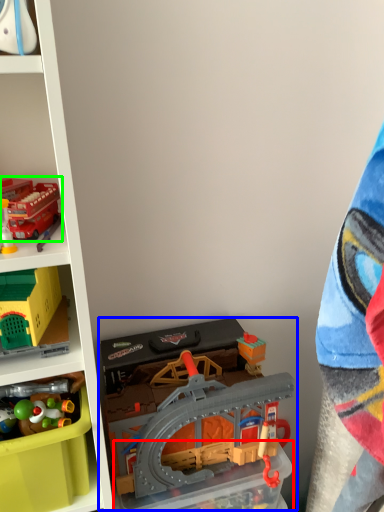
Question: Which is farther away from storage box (highlighted by a red box)? toy (highlighted by a blue box) or toy (highlighted by a green box)?

Choices:
 (A) toy
 (B) toy

Answer: (B)